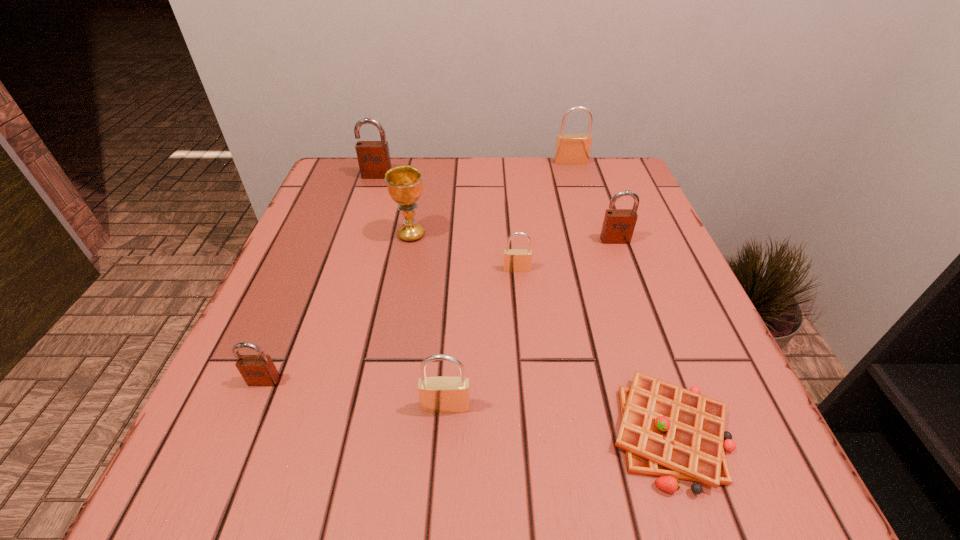
Find the location of a particular element. vacant area between the waffle and the chalice is located at coordinates (540, 334).

What are the coordinates of `free spot between the waffle and the third farthest padlock` in the screenshot? It's located at (642, 336).

Locate an element on the screen. free space between the leftmost brass padlock and the fourth nearest padlock is located at coordinates (530, 323).

You are a GUI agent. You are given a task and a screenshot of the screen. Output one action in this format:
    pyautogui.click(x=<x>, y=<y>)
    Task: Click on the free area in between the farthest brass padlock and the leftmost object
    This screenshot has height=540, width=960.
    Given the screenshot: What is the action you would take?
    pyautogui.click(x=418, y=272)

Where is `vacant space in between the second object from left to right and the third padlock from right to left`? This screenshot has width=960, height=540. vacant space in between the second object from left to right and the third padlock from right to left is located at coordinates (447, 222).

At what (x,y) coordinates should I click in order to perform the action: click on vacant area that lies between the gold chalice and the second smallest brown padlock. Please return your answer as a coordinate pair (x, y). Looking at the image, I should click on (513, 237).

Locate which object ranks fourth in proximity to the seventh object from right to left. Please provide its 2D coordinates. Your answer should be formatted as a tuple, i.e. [(x, y)], where the tuple contains the x and y coordinates of a point satisfying the conditions above.

[(618, 226)]

Locate which object is the fifth closest to the biggest brown padlock. Please provide its 2D coordinates. Your answer should be formatted as a tuple, i.e. [(x, y)], where the tuple contains the x and y coordinates of a point satisfying the conditions above.

[(257, 370)]

Identify which padlock is the fourth nearest to the second farthest padlock. Please provide its 2D coordinates. Your answer should be formatted as a tuple, i.e. [(x, y)], where the tuple contains the x and y coordinates of a point satisfying the conditions above.

[(257, 370)]

The width and height of the screenshot is (960, 540). Find the location of `padlock object that ranks as the fifth closest to the shortest object`. padlock object that ranks as the fifth closest to the shortest object is located at coordinates (571, 149).